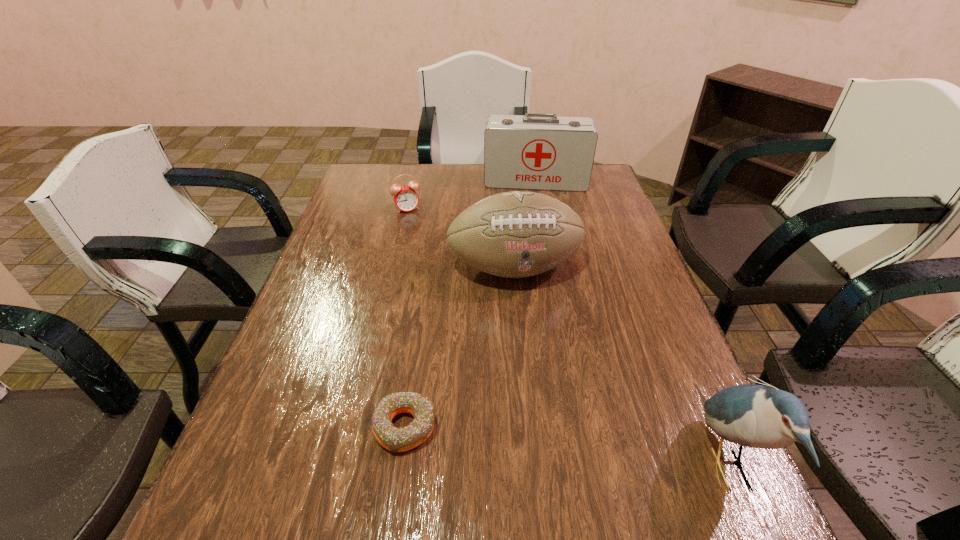
At what (x,y) coordinates should I click in order to perform the action: click on vacant space on the desktop that is between the shortest object and the rightmost object and is positioned on the laces of the football (American). Please return your answer as a coordinate pair (x, y). The width and height of the screenshot is (960, 540). Looking at the image, I should click on (573, 448).

The height and width of the screenshot is (540, 960). What are the coordinates of `free spot on the desktop that is between the shortest object and the rightmost object and is positioned on the clock face of the fourth nearest object` in the screenshot? It's located at (516, 441).

At what (x,y) coordinates should I click in order to perform the action: click on vacant space on the desktop that is between the doughnut and the rightmost object and is positioned on the front-facing side of the farthest object. Please return your answer as a coordinate pair (x, y). Looking at the image, I should click on (543, 444).